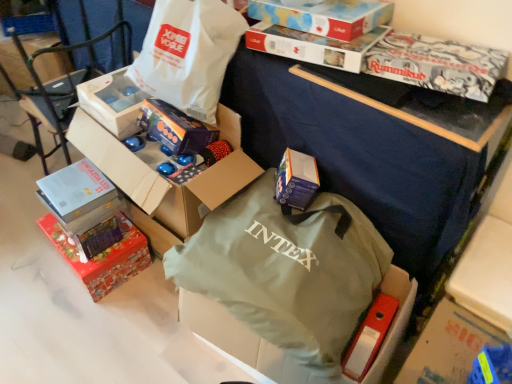
Where is `free space that is to the left of green fabric bag at center, acting as the first bag starting from the bottom`? Image resolution: width=512 pixels, height=384 pixels. free space that is to the left of green fabric bag at center, acting as the first bag starting from the bottom is located at coordinates (132, 334).